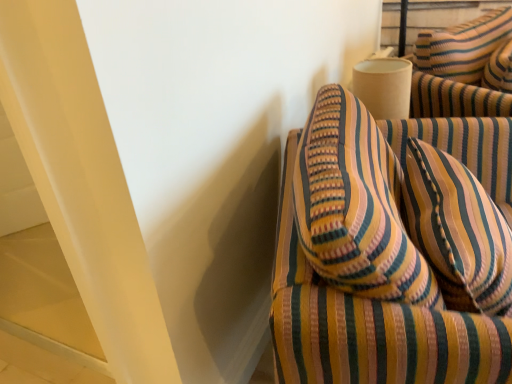
Question: Considering their positions, is striped fabric armchair at right located in front of or behind striped fabric pillow at right?

Choices:
 (A) behind
 (B) front

Answer: (B)

Question: From a real-world perspective, is striped fabric armchair at right physically located above or below striped fabric pillow at right?

Choices:
 (A) below
 (B) above

Answer: (A)

Question: Is point (396, 357) closer or farther from the camera than point (472, 223)?

Choices:
 (A) farther
 (B) closer

Answer: (B)

Question: In the image, is striped fabric pillow at right positioned in front of or behind striped fabric armchair at right?

Choices:
 (A) behind
 (B) front

Answer: (A)

Question: From a real-world perspective, relative to striped fabric armchair at right, is striped fabric pillow at right vertically above or below?

Choices:
 (A) above
 (B) below

Answer: (A)

Question: Is point pos(432,266) closer or farther from the camera than point pos(328,230)?

Choices:
 (A) farther
 (B) closer

Answer: (A)

Question: Considering the positions of striped fabric pillow at right and striped fabric armchair at right in the image, is striped fabric pillow at right bigger or smaller than striped fabric armchair at right?

Choices:
 (A) small
 (B) big

Answer: (A)